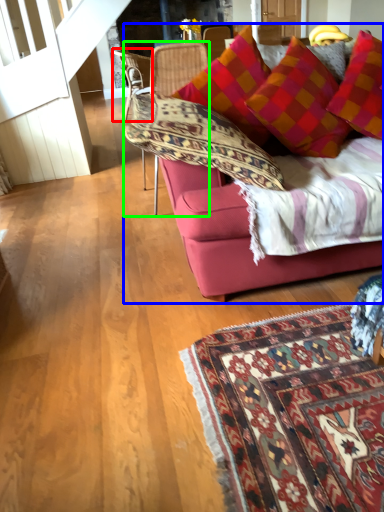
Question: Estimate the real-world distances between objects in this image. Which object is closer to chair (highlighted by a red box), studio couch (highlighted by a blue box) or chair (highlighted by a green box)?

Choices:
 (A) studio couch
 (B) chair

Answer: (B)